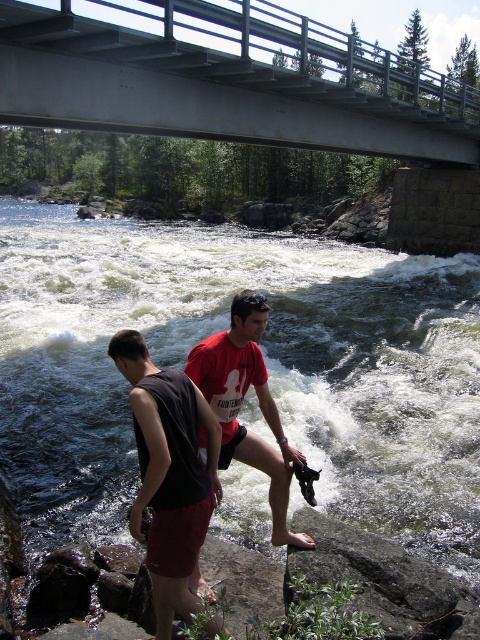
Question: Considering the relative positions of white frothy water at lower center and red matte t-shirt at center in the image provided, where is white frothy water at lower center located with respect to red matte t-shirt at center?

Choices:
 (A) left
 (B) right

Answer: (B)

Question: Among these points, which one is nearest to the camera?

Choices:
 (A) (63, 100)
 (B) (228, 396)
 (C) (180, 426)
 (D) (274, 250)

Answer: (C)

Question: Considering the real-world distances, which object is closest to the metallic gray bridge at upper center?

Choices:
 (A) red matte t-shirt at center
 (B) black cotton tank top at lower left
 (C) white frothy water at lower center

Answer: (C)

Question: Can you confirm if white frothy water at lower center is positioned below black cotton tank top at lower left?

Choices:
 (A) no
 (B) yes

Answer: (A)

Question: Which object is farther from the camera taking this photo?

Choices:
 (A) black cotton tank top at lower left
 (B) white frothy water at lower center

Answer: (B)

Question: Is white frothy water at lower center thinner than red matte t-shirt at center?

Choices:
 (A) no
 (B) yes

Answer: (A)